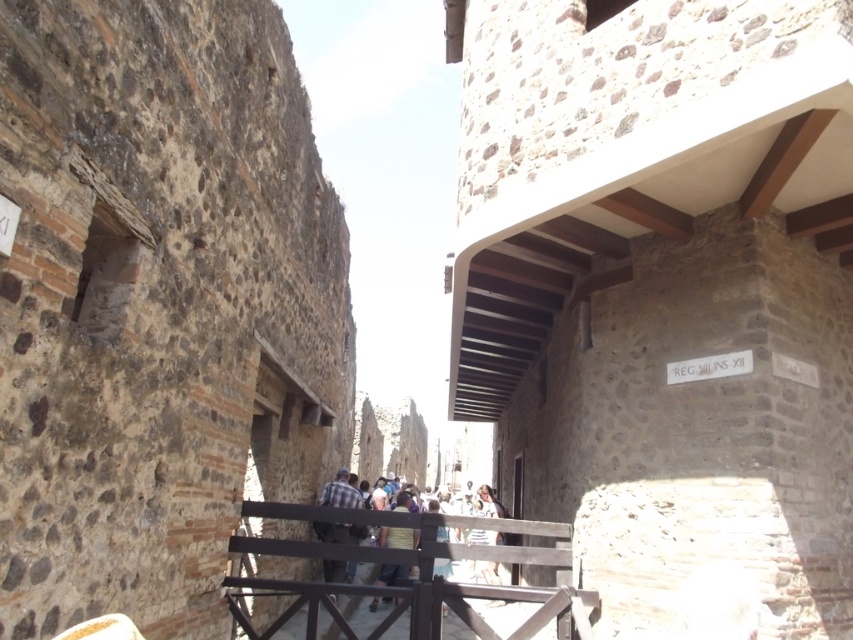
Is black wood rail at center positioned behind plaid shirt at center?

No, it is in front of plaid shirt at center.

Between black wood rail at center and plaid shirt at center, which one has less height?

With less height is black wood rail at center.

Is point (549, 554) farther from viewer compared to point (329, 564)?

No.

Where is `black wood rail at center`? black wood rail at center is located at coordinates (418, 576).